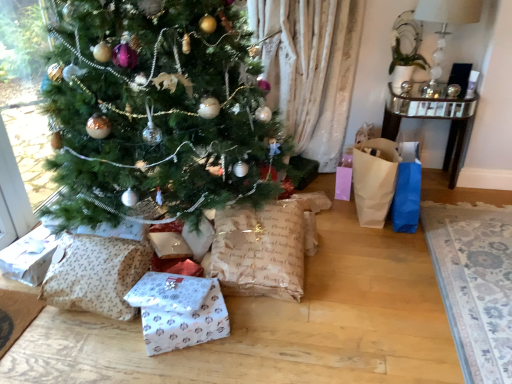
Question: Can you confirm if brown paper bag at right is taller than green matte christmas tree at center?

Choices:
 (A) yes
 (B) no

Answer: (B)

Question: Is green matte christmas tree at center completely or partially inside brown paper bag at right?

Choices:
 (A) yes
 (B) no

Answer: (B)

Question: Considering the relative sizes of brown paper bag at right and green matte christmas tree at center in the image provided, is brown paper bag at right smaller than green matte christmas tree at center?

Choices:
 (A) yes
 (B) no

Answer: (A)

Question: Is brown paper bag at right shorter than green matte christmas tree at center?

Choices:
 (A) no
 (B) yes

Answer: (B)

Question: Can you confirm if brown paper bag at right is wider than green matte christmas tree at center?

Choices:
 (A) yes
 (B) no

Answer: (B)

Question: Can you confirm if brown paper bag at right is positioned to the right of green matte christmas tree at center?

Choices:
 (A) yes
 (B) no

Answer: (A)

Question: Does patterned paper sack at lower left, the first sack when ordered from left to right, contain white paper gift at lower center?

Choices:
 (A) yes
 (B) no

Answer: (B)

Question: From a real-world perspective, is patterned paper sack at lower left, the first sack when ordered from left to right, physically above white paper gift at lower center?

Choices:
 (A) no
 (B) yes

Answer: (B)

Question: Is patterned paper sack at lower left, the first sack when ordered from left to right, at the left side of white paper gift at lower center?

Choices:
 (A) yes
 (B) no

Answer: (A)

Question: Considering the relative sizes of patterned paper sack at lower left, the 2th sack in the right-to-left sequence, and white paper gift at lower center in the image provided, is patterned paper sack at lower left, the 2th sack in the right-to-left sequence, smaller than white paper gift at lower center?

Choices:
 (A) yes
 (B) no

Answer: (B)

Question: Does patterned paper sack at lower left, the first sack when ordered from left to right, appear on the right side of white paper gift at lower center?

Choices:
 (A) no
 (B) yes

Answer: (A)

Question: Is patterned paper sack at lower left, the 2th sack in the right-to-left sequence, facing towards white paper gift at lower center?

Choices:
 (A) no
 (B) yes

Answer: (A)

Question: Considering the relative sizes of green matte christmas tree at center and patterned paper sack at lower left, the 2th sack in the right-to-left sequence, in the image provided, is green matte christmas tree at center shorter than patterned paper sack at lower left, the 2th sack in the right-to-left sequence,?

Choices:
 (A) yes
 (B) no

Answer: (B)